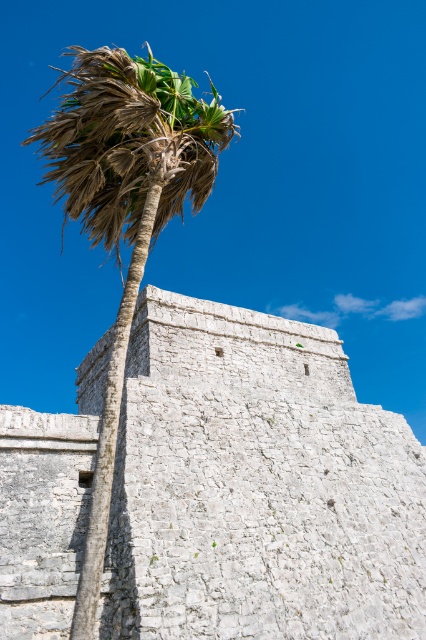
Does white stone wall at center have a greater width compared to brown leafy palm tree at left?

No, white stone wall at center is not wider than brown leafy palm tree at left.

Who is more distant from viewer, (405, 532) or (161, 109)?

The point (405, 532) is behind.

The width and height of the screenshot is (426, 640). What are the coordinates of `white stone wall at center` in the screenshot? It's located at (256, 486).